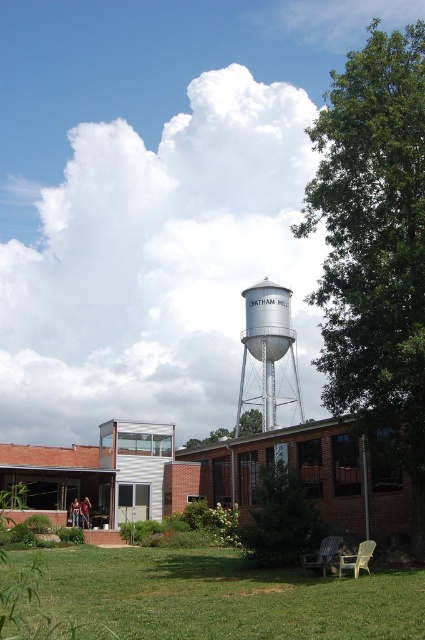
Can you confirm if green grass at lower center is taller than silver metallic water tower at center?

No.

Is green grass at lower center above silver metallic water tower at center?

Actually, green grass at lower center is below silver metallic water tower at center.

Who is more distant from viewer, (53, 550) or (243, 330)?

Positioned behind is point (243, 330).

You are a GUI agent. You are given a task and a screenshot of the screen. Output one action in this format:
    pyautogui.click(x=<x>, y=<y>)
    Task: Click on the green grass at lower center
    This screenshot has width=425, height=640.
    Given the screenshot: What is the action you would take?
    pyautogui.click(x=223, y=596)